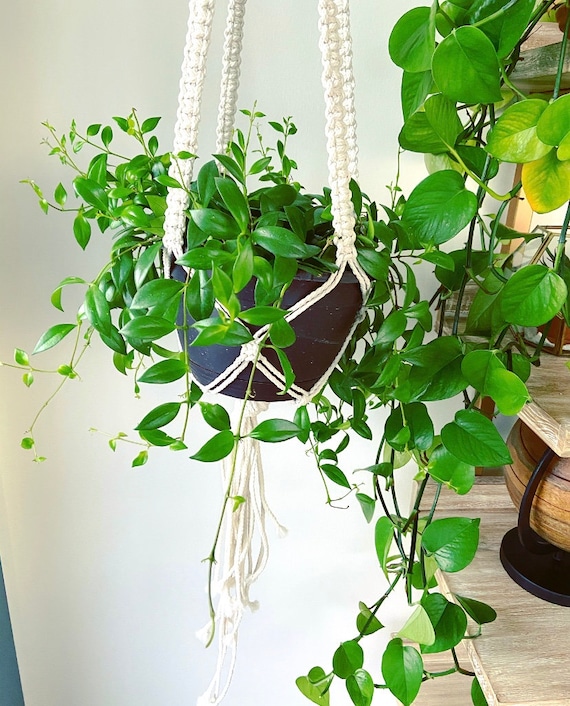
At what (x,y) coordinates should I click in order to perform the action: click on curtain. Please return your answer as a coordinate pair (x, y). The width and height of the screenshot is (570, 706). Looking at the image, I should click on (14, 690).